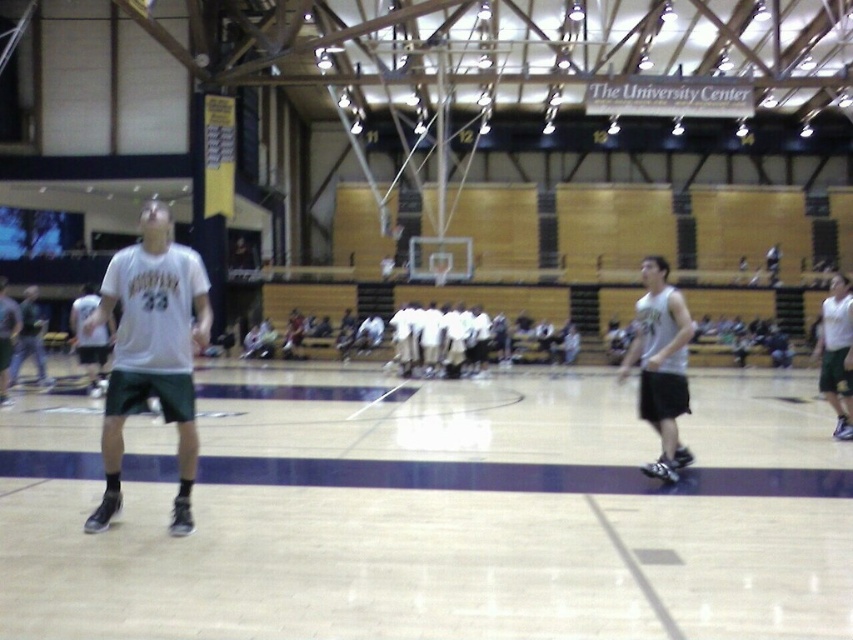
You are a photographer setting up a camera on the basketball court. You need to capture both the white matte jersey at center and the white jersey at left in the same frame. Which jersey should you focus on first to ensure both are in focus?

You should focus on the white matte jersey at center first because it is larger in size compared to the white jersey at left, ensuring it will be in focus while the other remains within the depth of field.

You are a referee standing at the center of the court. You need to determine which of the two points, point (257,564) or point (619,376), is closer to the front of the court. Based on the coordinates provided, which point is in front?

Point (257,564) is in front of point (619,376), so it is closer to the front of the court.

You are a basketball coach analyzing the court layout. You notice a point marked at coordinates [152,353]. Based on the scene description, where is this point located?

The point is on the white matte jersey at center.